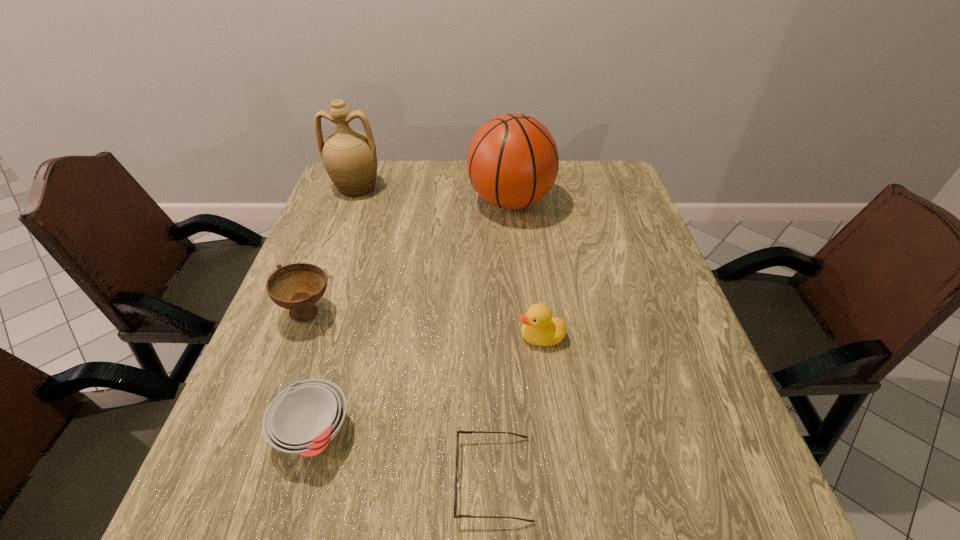
You are a GUI agent. You are given a task and a screenshot of the screen. Output one action in this format:
    pyautogui.click(x=<x>, y=<y>)
    Task: Click on the vacant area between the taller soup bowl and the basketball
    This screenshot has width=960, height=540.
    Given the screenshot: What is the action you would take?
    (409, 256)

I want to click on free area in between the pitcher and the basketball, so 433,194.

The image size is (960, 540). What are the coordinates of `free space between the basketball and the duckling` in the screenshot? It's located at (526, 269).

This screenshot has height=540, width=960. In order to click on vacant space in between the taller soup bowl and the duckling in this screenshot , I will do `click(424, 324)`.

Where is `vacant area that lies between the taller soup bowl and the basketball`? The width and height of the screenshot is (960, 540). vacant area that lies between the taller soup bowl and the basketball is located at coordinates (409, 256).

What are the coordinates of `free space that is in between the shortest object and the fourth tallest object` in the screenshot? It's located at pyautogui.click(x=517, y=408).

Where is `vacant area that lies between the third shortest object and the basketball`? vacant area that lies between the third shortest object and the basketball is located at coordinates (526, 269).

Where is `free spot between the shortest object and the pitcher`? This screenshot has height=540, width=960. free spot between the shortest object and the pitcher is located at coordinates (425, 333).

Identify which object is located as the fifth nearest to the basketball. Please provide its 2D coordinates. Your answer should be formatted as a tuple, i.e. [(x, y)], where the tuple contains the x and y coordinates of a point satisfying the conditions above.

[(457, 480)]

The height and width of the screenshot is (540, 960). In order to click on object that is the second closest one to the fourth tallest object in this screenshot , I will do click(x=302, y=419).